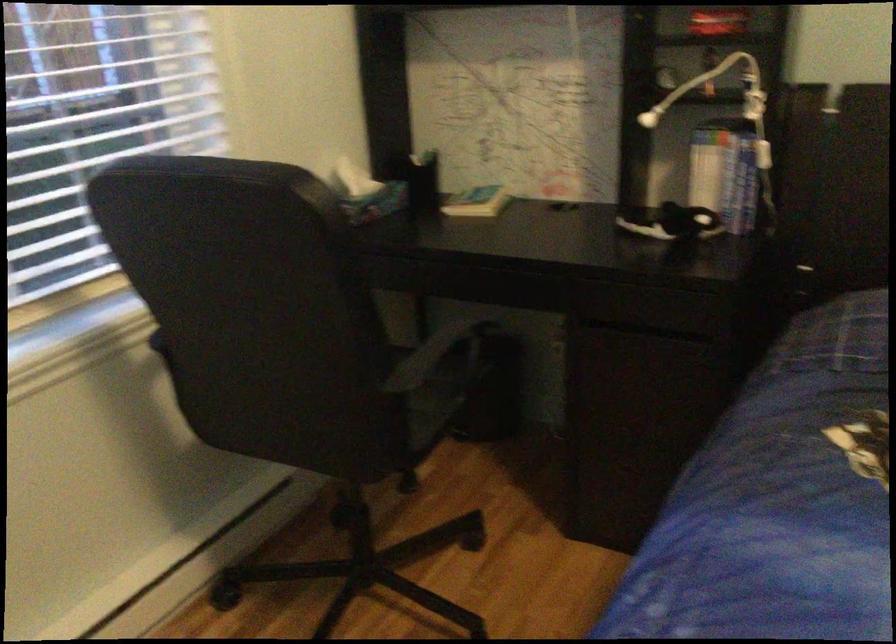
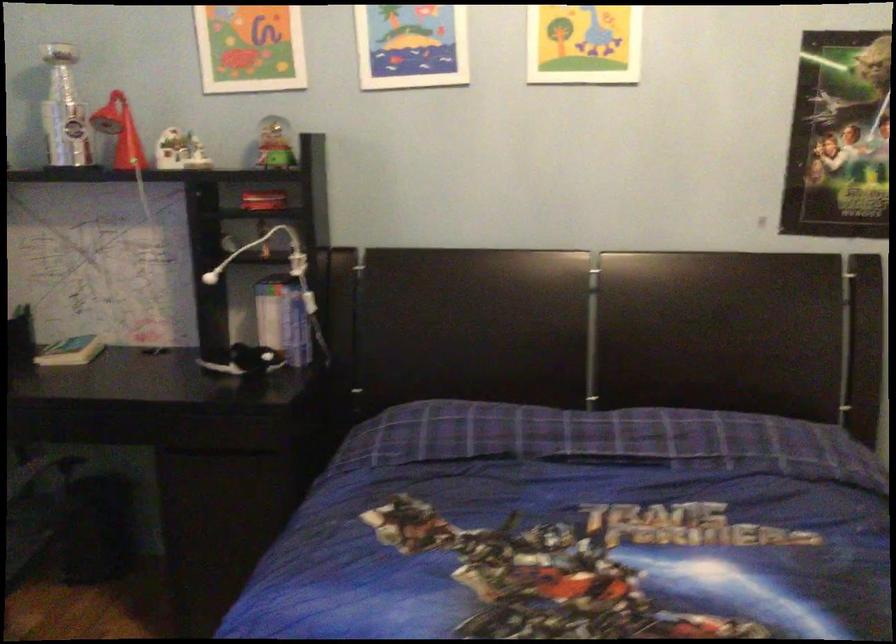
The point at (478, 200) is marked in the first image. Where is the corresponding point in the second image?

(71, 351)